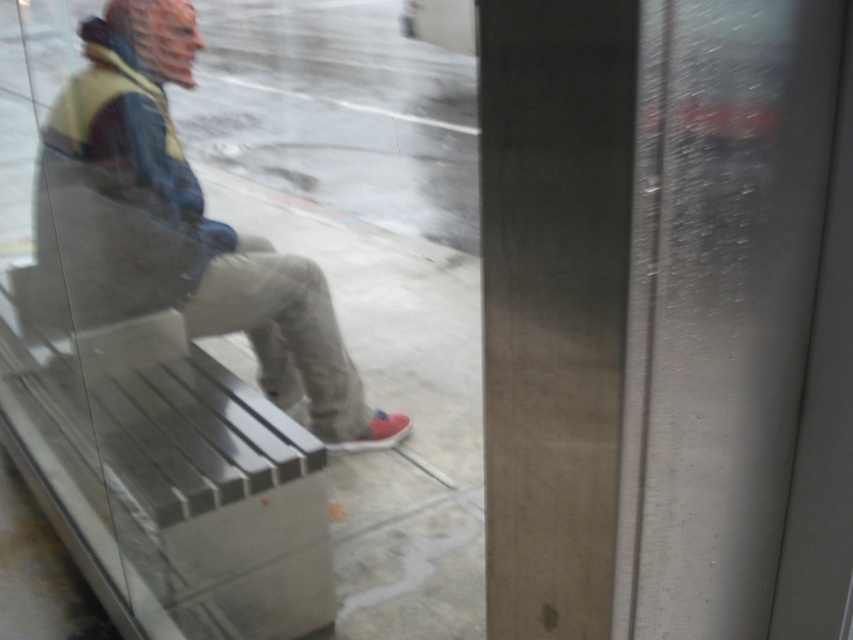
You are a delivery person who needs to place a package between the matte black jacket at center and the red suede shoe at lower center. Can you fit the package there if it is 1 meter wide?

The matte black jacket at center might be wider than red suede shoe at lower center, but the exact width isn not provided. Without knowing the distance between them, it is impossible to determine if the package will fit.

You are a delivery person who needs to confirm the exact location of the package before handing it over. The package is placed between the matte black jacket at center and the red suede shoe at lower center. Can you determine if the package will fit in the space between them?

The distance between the matte black jacket at center and the red suede shoe at lower center is 53.11 centimeters. Since the package dimensions are not provided, it is impossible to determine if it will fit in the space between them.

Based on the photo, you are a delivery person trying to identify the customer waiting on the bench. You see the matte black jacket at center and the red suede shoe at lower center. Which object is closer to you through the window?

The matte black jacket at center is closer to you because it is in front of the red suede shoe at lower center.